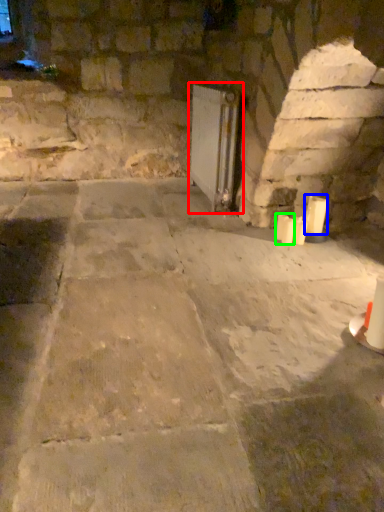
Question: Based on their relative distances, which object is farther from fireplace (highlighted by a red box)? Choose from candle (highlighted by a blue box) and candle (highlighted by a green box).

Choices:
 (A) candle
 (B) candle

Answer: (A)